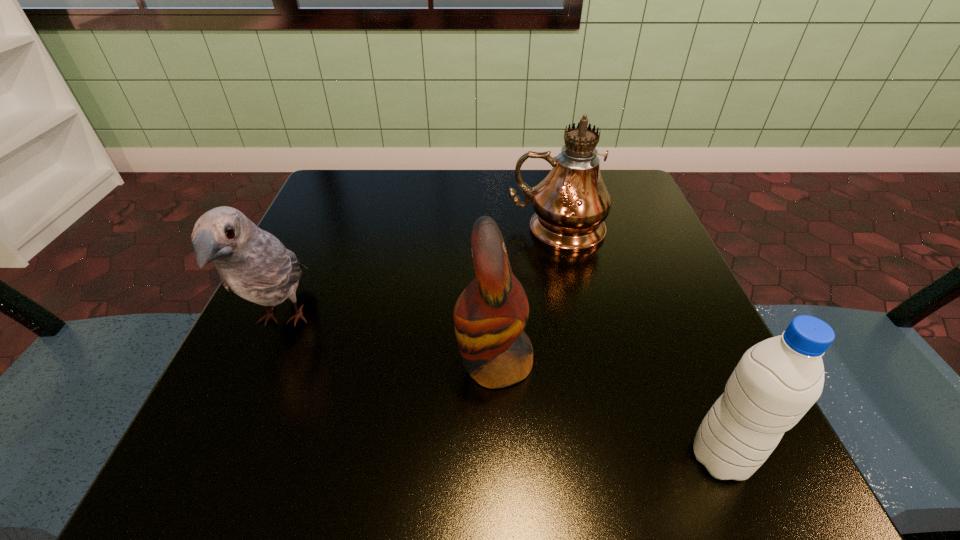
Where is `oil lamp`? This screenshot has width=960, height=540. oil lamp is located at coordinates (571, 203).

Find the location of a particular element. The height and width of the screenshot is (540, 960). the farthest object is located at coordinates (571, 203).

The image size is (960, 540). I want to click on the right parrot, so click(x=489, y=316).

Locate an element on the screen. The image size is (960, 540). the left parrot is located at coordinates (253, 263).

Locate an element on the screen. The height and width of the screenshot is (540, 960). the nearest object is located at coordinates (775, 383).

I want to click on the rightmost object, so click(x=775, y=383).

The width and height of the screenshot is (960, 540). Find the location of `free region located 0.110m on the left of the farthest object`. free region located 0.110m on the left of the farthest object is located at coordinates (455, 230).

In order to click on vacant space located 0.300m on the face of the right parrot in this screenshot , I will do `click(253, 363)`.

Identify the location of vacant space situated 0.290m on the face of the right parrot. [260, 363].

Identify the location of free space located 0.100m on the face of the right parrot. (389, 363).